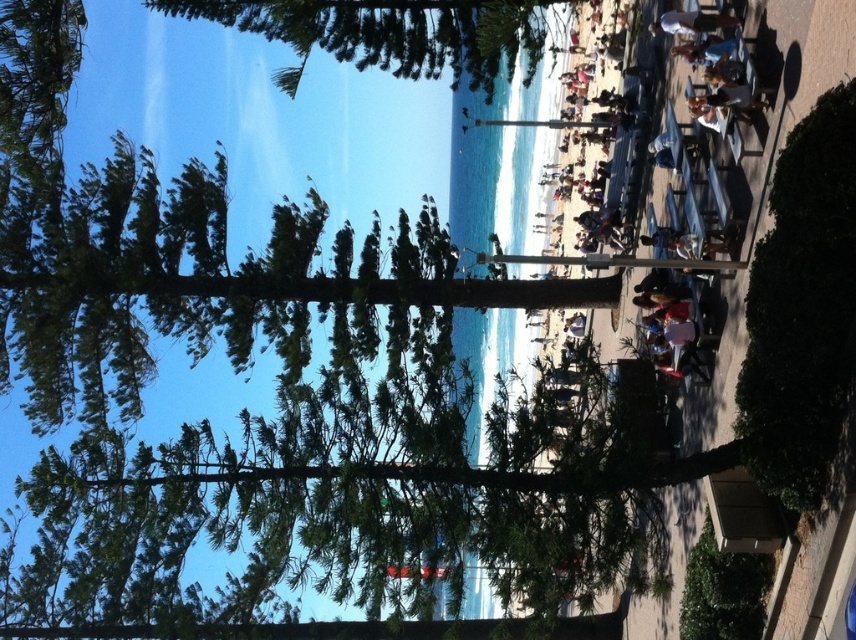
Question: Which object appears farthest from the camera in this image?

Choices:
 (A) white fabric shirt at upper right
 (B) green leafy bush at lower right
 (C) green leafy tree at upper center

Answer: (C)

Question: Is green leafy bush at lower right closer to the viewer compared to white fabric shirt at upper right?

Choices:
 (A) no
 (B) yes

Answer: (B)

Question: Is green leafy bush at lower right smaller than green leafy tree at upper center?

Choices:
 (A) yes
 (B) no

Answer: (A)

Question: Which point is farther to the camera?

Choices:
 (A) green leafy bush at lower right
 (B) green leafy tree at upper center

Answer: (B)

Question: Which of the following is the closest to the observer?

Choices:
 (A) white fabric shirt at upper right
 (B) green leafy tree at upper center

Answer: (A)

Question: Can you confirm if green leafy bush at lower right is thinner than green leafy tree at upper center?

Choices:
 (A) yes
 (B) no

Answer: (A)